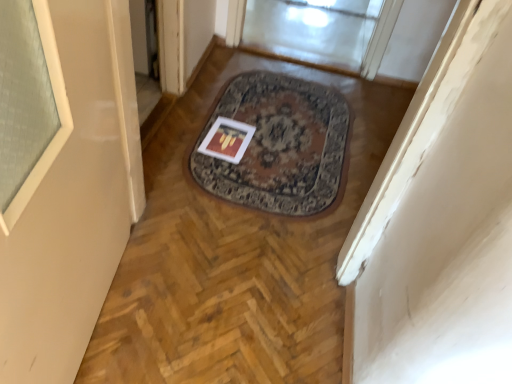
You are a GUI agent. You are given a task and a screenshot of the screen. Output one action in this format:
    pyautogui.click(x=<x>, y=<y>)
    Task: Click on the blank area beneath matte paper postcard at center (from a real-world perspective)
    This screenshot has height=384, width=512.
    Given the screenshot: What is the action you would take?
    pyautogui.click(x=229, y=139)